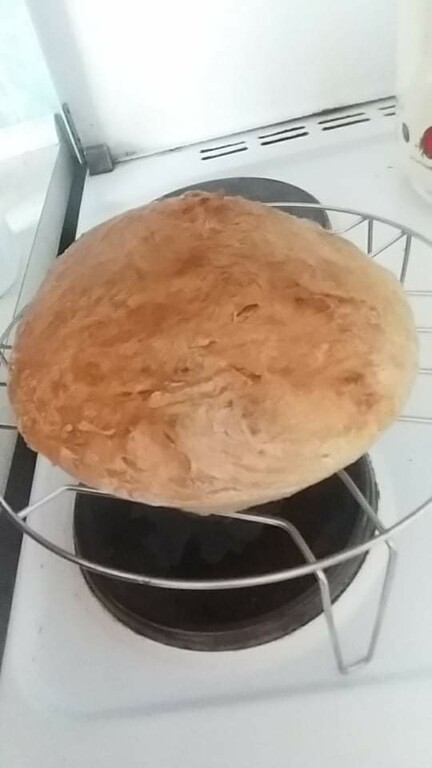
Find the location of a particular element. The width and height of the screenshot is (432, 768). stove top burner is located at coordinates (225, 537), (255, 192).